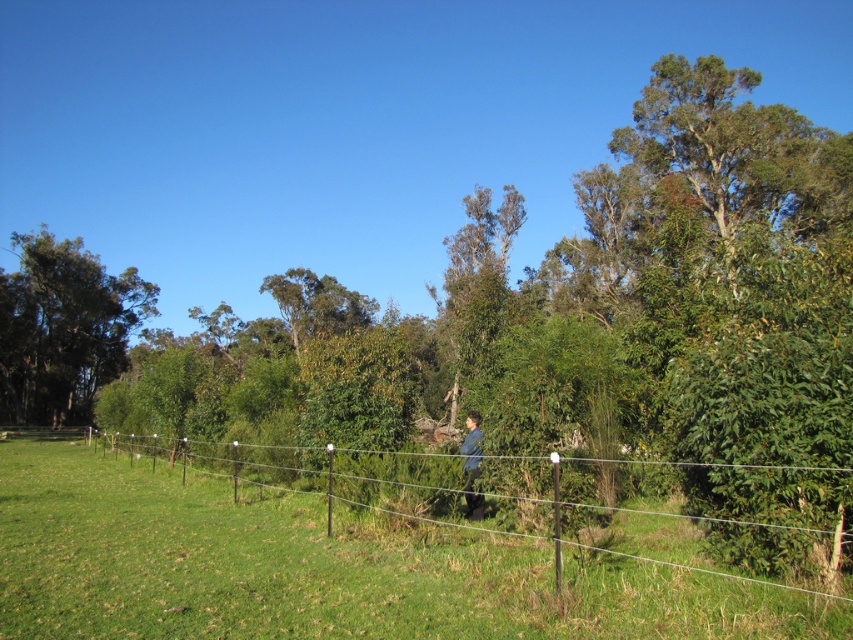
Question: Is green wire fence at center smaller than blue denim jacket at center?

Choices:
 (A) no
 (B) yes

Answer: (A)

Question: Which point appears closest to the camera in this image?

Choices:
 (A) (653, 612)
 (B) (97, 260)

Answer: (A)

Question: Does green wire fence at center appear on the left side of green leafy tree at left?

Choices:
 (A) no
 (B) yes

Answer: (A)

Question: Which of the following is the closest to the observer?

Choices:
 (A) (468, 445)
 (B) (170, 556)

Answer: (B)

Question: Can you confirm if green leafy tree at left is positioned to the left of blue denim jacket at center?

Choices:
 (A) yes
 (B) no

Answer: (A)

Question: Among these points, which one is nearest to the camera?

Choices:
 (A) (9, 388)
 (B) (476, 458)

Answer: (B)